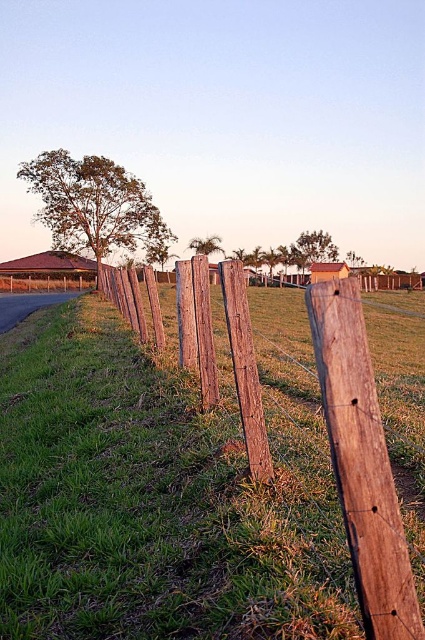
Is point (387, 509) farther from viewer compared to point (272, 474)?

That is False.

Is point (356, 332) behind point (246, 394)?

No, (356, 332) is closer to viewer.

Locate an element on the screen. weathered wood fence at center is located at coordinates (362, 461).

Which of these two, brown wooden post at center or weathered wood post at center, stands shorter?

brown wooden post at center is shorter.

Between point (370, 397) and point (232, 349), which one is positioned behind?

The point (232, 349) is behind.

Which is behind, point (337, 330) or point (252, 381)?

Point (252, 381)

This screenshot has height=640, width=425. I want to click on brown wooden post at center, so click(x=362, y=461).

Is point (365, 348) farther from camera compared to point (334, 356)?

That is True.

Does weathered wood fence at center come behind brown wooden post at center?

That is True.

Is point (356, 476) in front of point (359, 417)?

Yes, it is.

Locate an element on the screen. The width and height of the screenshot is (425, 640). weathered wood fence at center is located at coordinates (362, 461).